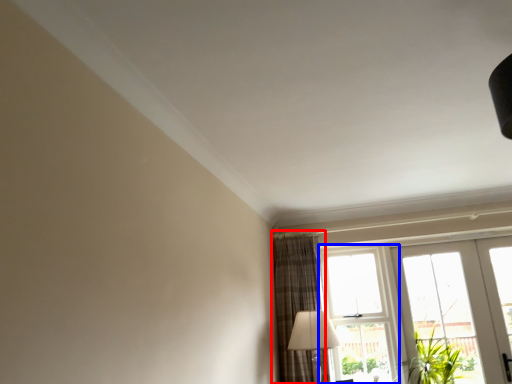
Question: Which object is further to the camera taking this photo, curtain (highlighted by a red box) or window (highlighted by a blue box)?

Choices:
 (A) curtain
 (B) window

Answer: (B)